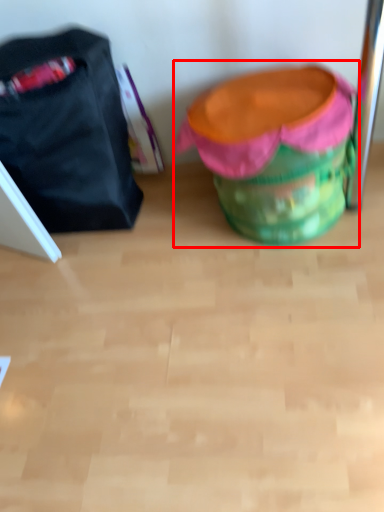
Question: Where is bean bag chair (annotated by the red box) located in relation to luggage and bags in the image?

Choices:
 (A) left
 (B) right

Answer: (B)